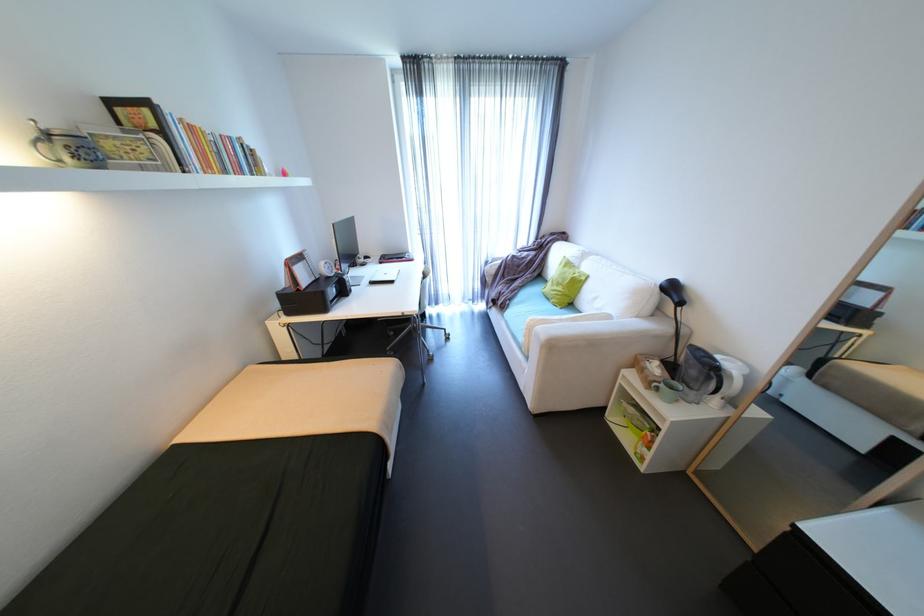
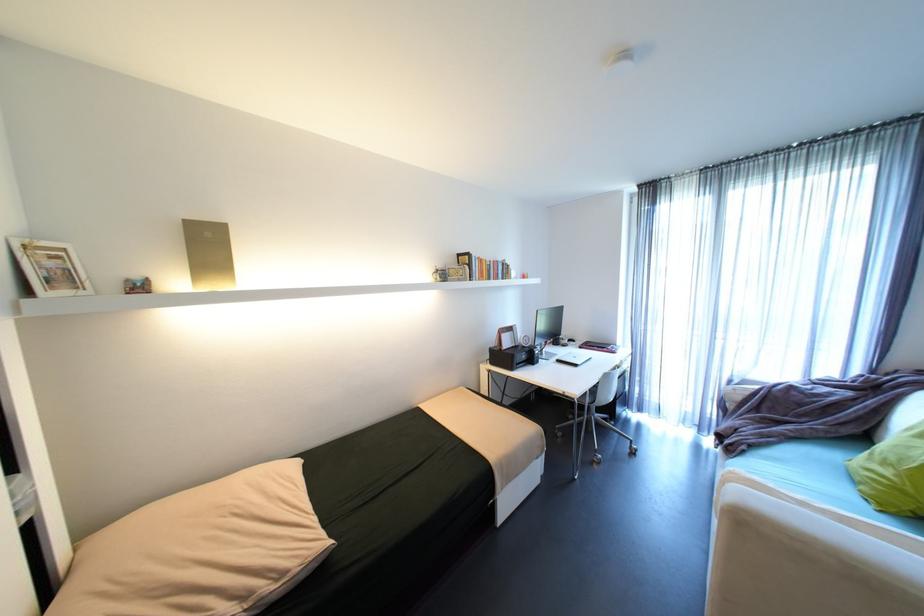
The point at (542,328) is marked in the first image. Where is the corresponding point in the second image?

(737, 485)